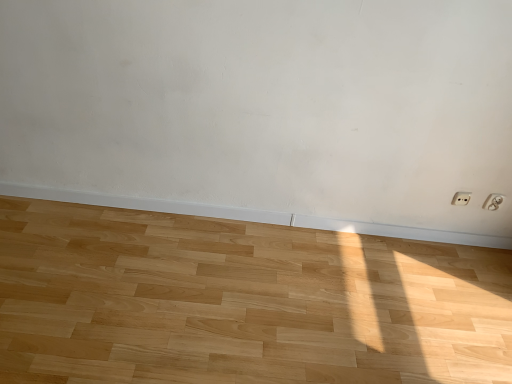
Question: Is white plastic electric outlet at lower right, the second electric outlet viewed from the right, to the left of natural wood floor at center from the viewer's perspective?

Choices:
 (A) yes
 (B) no

Answer: (B)

Question: From a real-world perspective, is white plastic electric outlet at lower right, the second electric outlet viewed from the right, below natural wood floor at center?

Choices:
 (A) yes
 (B) no

Answer: (B)

Question: Is white plastic electric outlet at lower right, the second electric outlet viewed from the right, smaller than natural wood floor at center?

Choices:
 (A) no
 (B) yes

Answer: (B)

Question: From a real-world perspective, is white plastic electric outlet at lower right, the second electric outlet viewed from the right, over natural wood floor at center?

Choices:
 (A) no
 (B) yes

Answer: (B)

Question: Is natural wood floor at center completely or partially inside white plastic electric outlet at lower right, the second electric outlet viewed from the right?

Choices:
 (A) yes
 (B) no

Answer: (B)

Question: From the image's perspective, is white plastic electric outlet at lower right, which is the first electric outlet from left to right, over natural wood floor at center?

Choices:
 (A) no
 (B) yes

Answer: (B)

Question: Is natural wood floor at center shorter than white plastic electric outlet at lower right, the 2th electric outlet when ordered from left to right?

Choices:
 (A) no
 (B) yes

Answer: (B)

Question: Does natural wood floor at center contain white plastic electric outlet at lower right, the 2th electric outlet when ordered from left to right?

Choices:
 (A) yes
 (B) no

Answer: (B)

Question: Considering the relative positions of natural wood floor at center and white plastic electric outlet at lower right, the 2th electric outlet when ordered from left to right, in the image provided, is natural wood floor at center to the right of white plastic electric outlet at lower right, the 2th electric outlet when ordered from left to right, from the viewer's perspective?

Choices:
 (A) yes
 (B) no

Answer: (B)

Question: Is natural wood floor at center wider than white plastic electric outlet at lower right, which is counted as the 1th electric outlet, starting from the right?

Choices:
 (A) yes
 (B) no

Answer: (A)

Question: Is natural wood floor at center not close to white plastic electric outlet at lower right, which is counted as the 1th electric outlet, starting from the right?

Choices:
 (A) no
 (B) yes

Answer: (B)

Question: Can you confirm if natural wood floor at center is smaller than white plastic electric outlet at lower right, the 2th electric outlet when ordered from left to right?

Choices:
 (A) no
 (B) yes

Answer: (A)

Question: From the image's perspective, is white plastic electric outlet at lower right, the 2th electric outlet when ordered from left to right, over white plastic electric outlet at lower right, the second electric outlet viewed from the right?

Choices:
 (A) yes
 (B) no

Answer: (B)